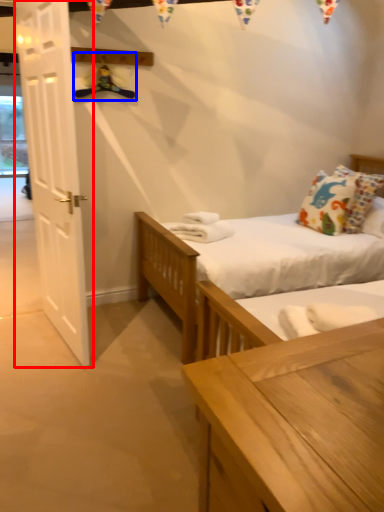
Question: Which point is closer to the camera, door (highlighted by a red box) or hanger (highlighted by a blue box)?

Choices:
 (A) door
 (B) hanger

Answer: (A)